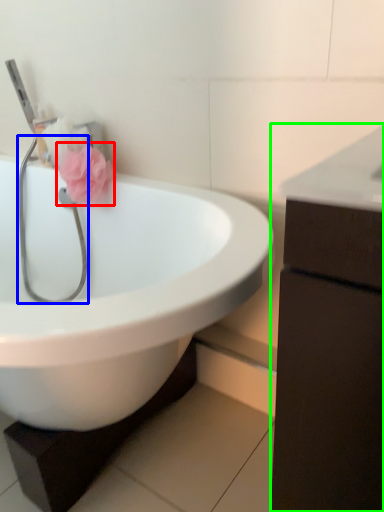
Question: Which object is the closest to the flower (highlighted by a red box)? Choose among these: stethoscope (highlighted by a blue box) or bathroom cabinet (highlighted by a green box).

Choices:
 (A) stethoscope
 (B) bathroom cabinet

Answer: (A)